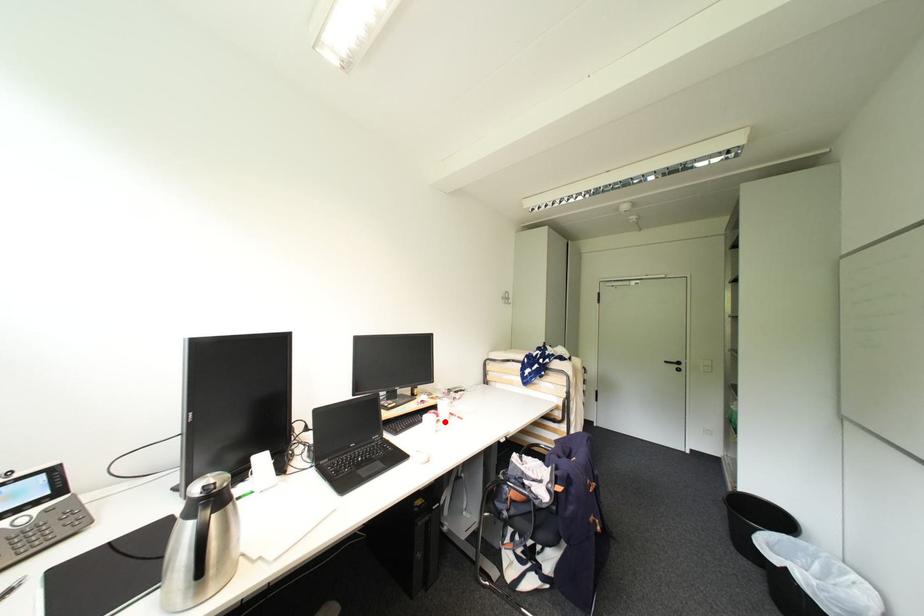
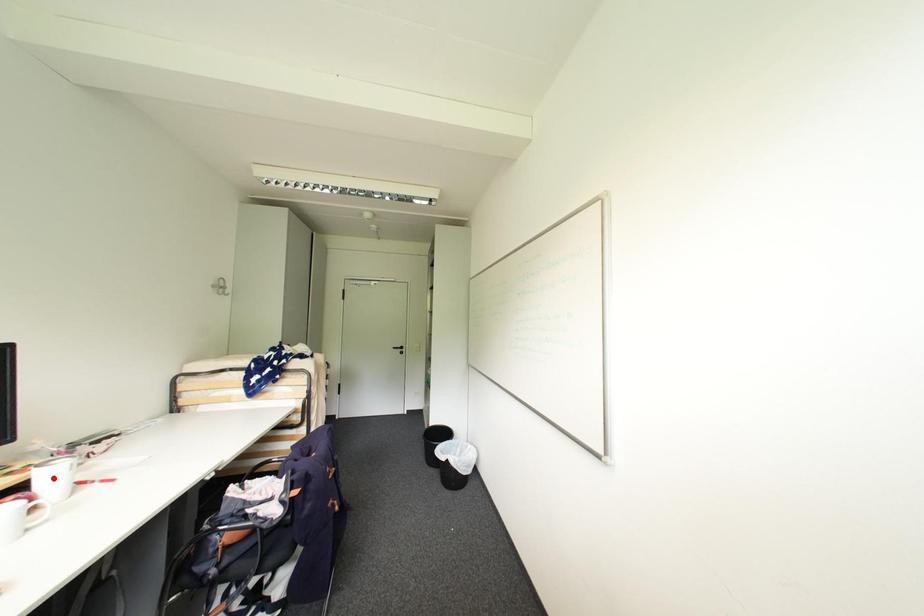
I am providing you with two images of the same scene from different viewpoints. A red point is marked on the first image and another point is marked on the second image. Do the highlighted points in image1 and image2 indicate the same real-world spot?

No